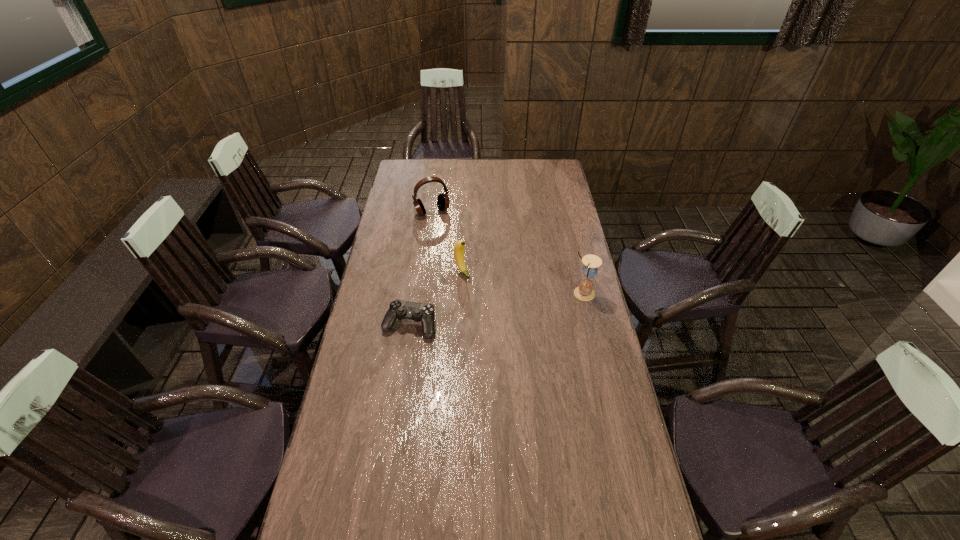
This screenshot has height=540, width=960. I want to click on vacant space in between the headset and the nearest object, so click(420, 268).

Where is `the third closest object relative to the nearest object`? the third closest object relative to the nearest object is located at coordinates (443, 202).

At what (x,y) coordinates should I click in order to perform the action: click on the third closest object to the control. Please return your answer as a coordinate pair (x, y). Looking at the image, I should click on (443, 202).

The image size is (960, 540). Identify the location of vacant position in the image that satisfies the following two spatial constraints: 1. on the front side of the rightmost object; 2. on the right side of the third object from left to right. (461, 293).

Where is `free space that satisfies the following two spatial constraints: 1. on the back side of the shortest object; 2. on the right side of the third object from left to right`? Image resolution: width=960 pixels, height=540 pixels. free space that satisfies the following two spatial constraints: 1. on the back side of the shortest object; 2. on the right side of the third object from left to right is located at coordinates (418, 271).

The image size is (960, 540). Find the location of `free location that satisfies the following two spatial constraints: 1. on the front side of the farthest object; 2. on the left side of the third nearest object`. free location that satisfies the following two spatial constraints: 1. on the front side of the farthest object; 2. on the left side of the third nearest object is located at coordinates (424, 271).